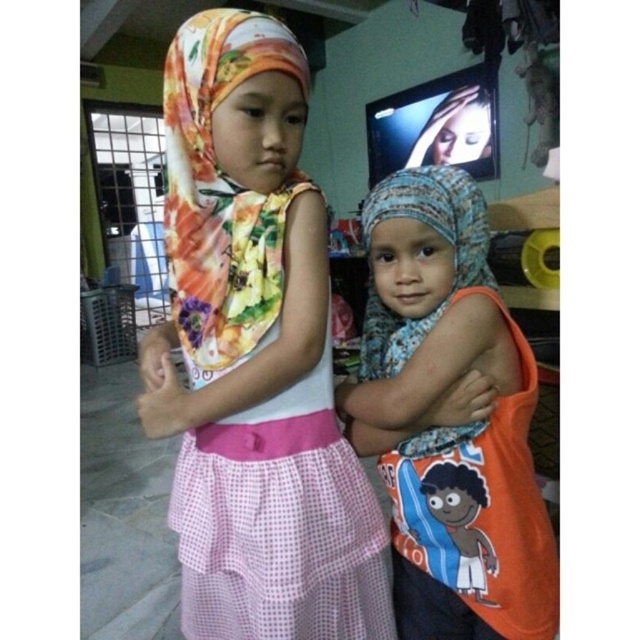
Does blue printed scarf at center appear under smooth skin face at upper right?

Indeed, blue printed scarf at center is positioned under smooth skin face at upper right.

Is point (541, 620) closer to viewer compared to point (476, 92)?

Yes.

What do you see at coordinates (451, 426) in the screenshot? This screenshot has height=640, width=640. I see `blue printed scarf at center` at bounding box center [451, 426].

This screenshot has width=640, height=640. Find the location of `blue printed scarf at center`. blue printed scarf at center is located at coordinates (451, 426).

Based on the photo, does floral fabric hijab at upper left have a smaller size compared to smooth skin face at upper right?

Incorrect, floral fabric hijab at upper left is not smaller in size than smooth skin face at upper right.

This screenshot has width=640, height=640. What do you see at coordinates (253, 355) in the screenshot?
I see `floral fabric hijab at upper left` at bounding box center [253, 355].

Locate an element on the screen. This screenshot has height=640, width=640. floral fabric hijab at upper left is located at coordinates (253, 355).

This screenshot has height=640, width=640. Identify the location of floral fabric hijab at upper left. (253, 355).

From the picture: Does floral fabric hijab at upper left appear over blue printed scarf at center?

Yes.

Is point (257, 401) positioned in front of point (454, 611)?

That is True.

This screenshot has width=640, height=640. I want to click on floral fabric hijab at upper left, so click(253, 355).